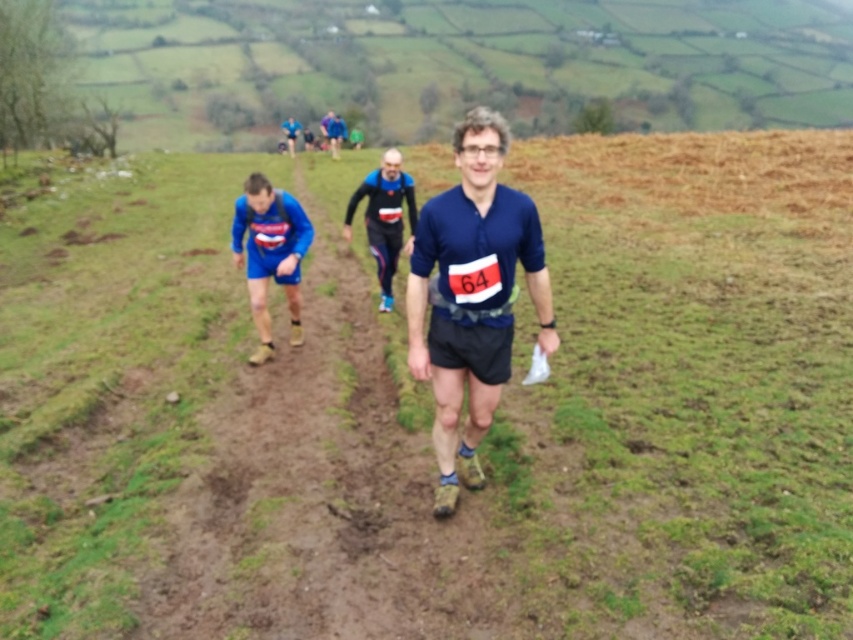
Who is lower down, matte blue shorts at center or blue fabric shirt at upper center?

matte blue shorts at center is lower down.

Between matte blue shorts at center and blue fabric shirt at upper center, which one appears on the left side from the viewer's perspective?

blue fabric shirt at upper center

Who is more forward, (293, 300) or (341, 120)?

Positioned in front is point (293, 300).

Where is `matte blue shorts at center`? matte blue shorts at center is located at coordinates (270, 253).

Who is lower down, matte blue shorts at center or blue fabric runner at upper center?

matte blue shorts at center is below.

Where is `matte blue shorts at center`? This screenshot has width=853, height=640. matte blue shorts at center is located at coordinates (270, 253).

Locate an element on the screen. matte blue shorts at center is located at coordinates (270, 253).

I want to click on matte blue shorts at center, so click(x=270, y=253).

Who is higher up, brown dirt track at center or blue fabric shirt at center?

blue fabric shirt at center is higher up.

This screenshot has width=853, height=640. Find the location of `brown dirt track at center`. brown dirt track at center is located at coordinates (325, 484).

The width and height of the screenshot is (853, 640). Identify the location of brown dirt track at center. (325, 484).